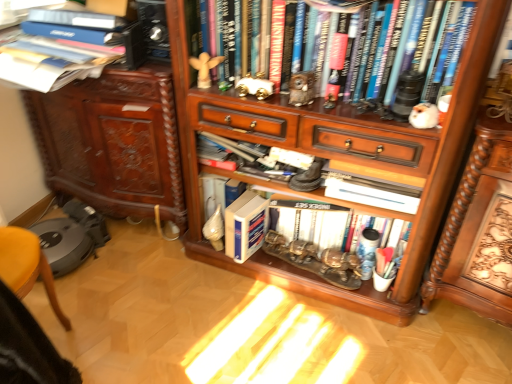
This screenshot has height=384, width=512. I want to click on free spot below hardcover book at upper left, positioned as the first book in top-to-bottom order (from a real-world perspective), so click(78, 23).